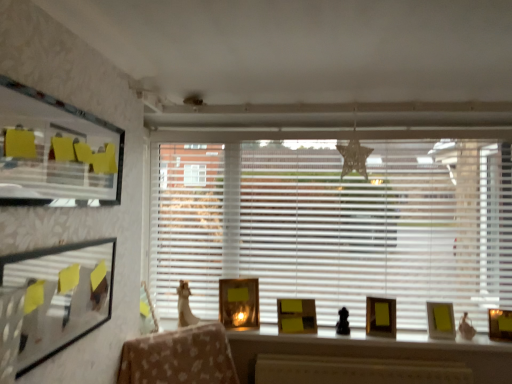
Question: In the image, is yellow sticky notes at upper left on the left side or the right side of yellow matte picture frame at center, the 4th picture frame positioned from the right?

Choices:
 (A) right
 (B) left

Answer: (B)

Question: From the image's perspective, is yellow sticky notes at upper left positioned above or below yellow matte picture frame at center, the 4th picture frame positioned from the right?

Choices:
 (A) below
 (B) above

Answer: (B)

Question: Which of these objects is positioned closest to the matte gold picture frame at right, the second picture frame viewed from the right?

Choices:
 (A) matte gold picture frame at center, which is the fourth picture frame in left-to-right order
 (B) matte gold picture frame at right, the first picture frame from the right
 (C) wooden desk at center
 (D) yellow sticky notes at upper left
 (E) matte black picture frame at left, the first picture frame when ordered from front to back

Answer: (B)

Question: Estimate the real-world distances between objects in this image. Which object is closer to the yellow sticky notes at upper left?

Choices:
 (A) white plastic blinds at center
 (B) matte gold picture frame at center, which is counted as the fourth picture frame, starting from the back
 (C) yellow matte picture frame at center, positioned as the 2th picture frame in back-to-front order
 (D) matte black picture frame at left, the 6th picture frame positioned from the right
 (E) wooden desk at center

Answer: (D)